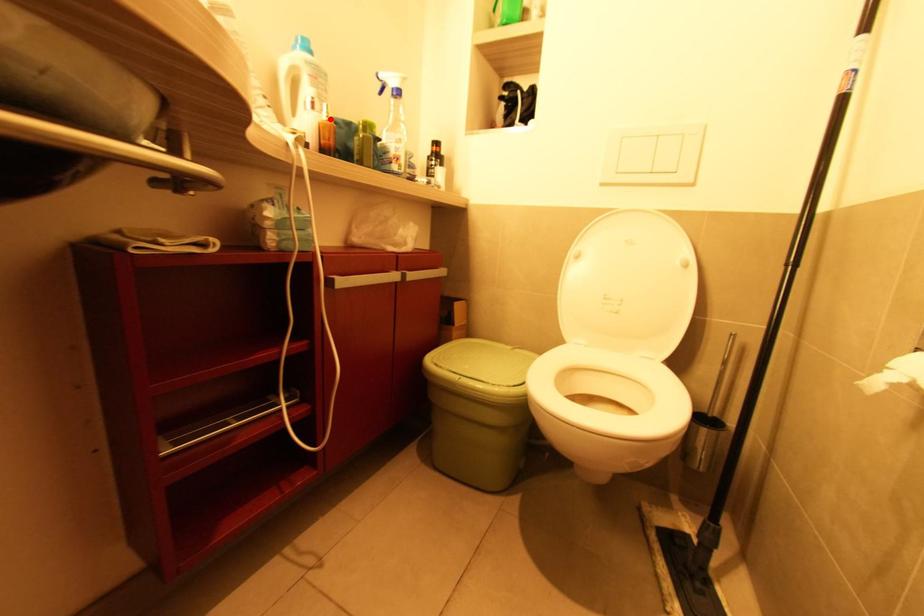
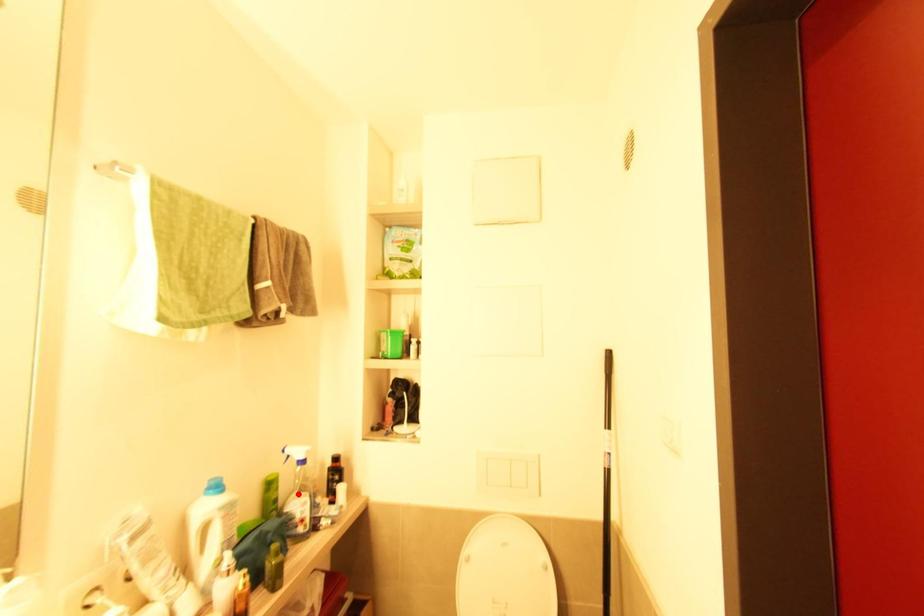
I am providing you with two images of the same scene from different viewpoints. A red point is marked on the first image and another point is marked on the second image. Is the red point in image1 aligned with the point shown in image2?

No